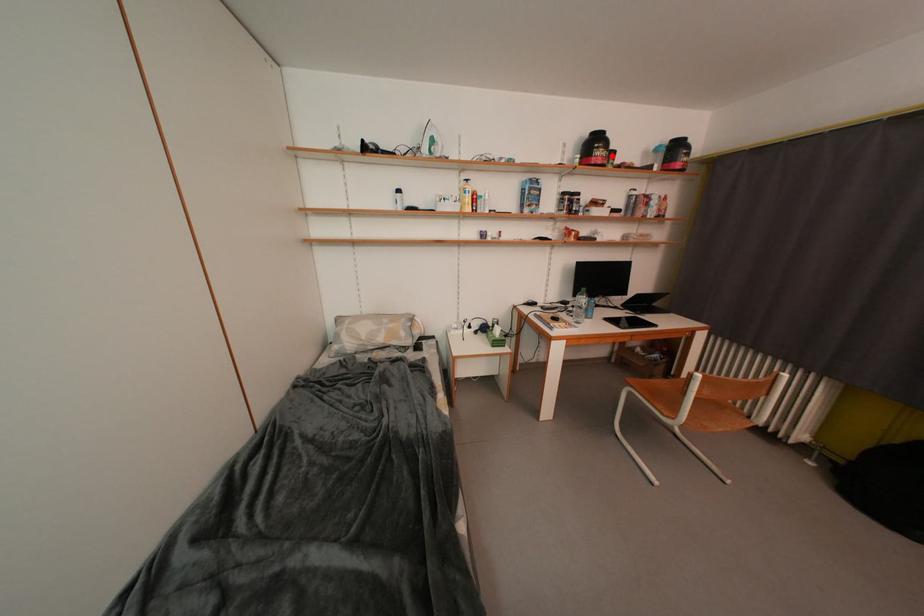
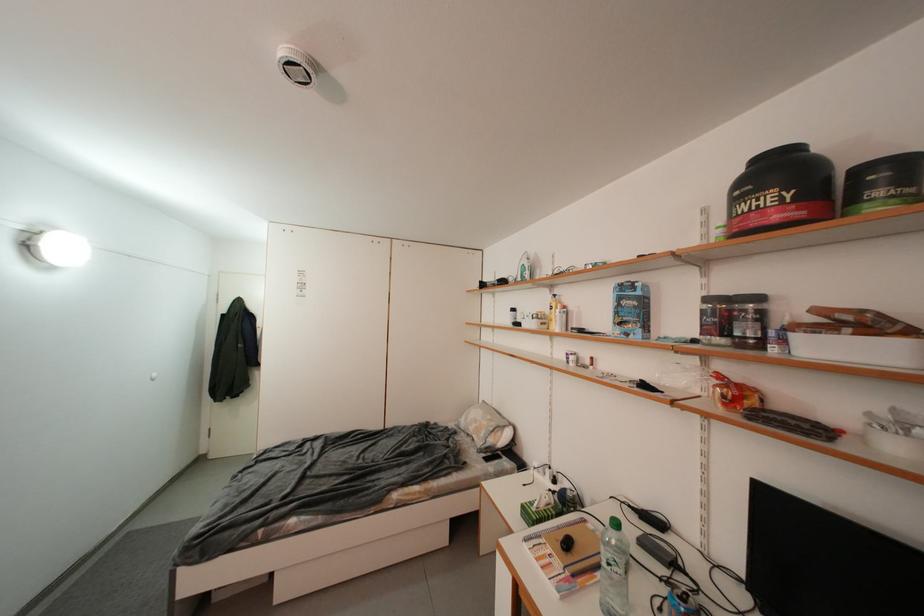
Find the pixel in the second image that matches the highlighted location in the first image.

(776, 201)